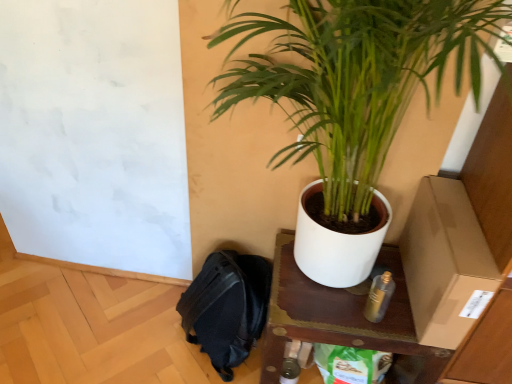
Where is `free space to the left of black fabric backpack at lower left`? This screenshot has height=384, width=512. free space to the left of black fabric backpack at lower left is located at coordinates (133, 331).